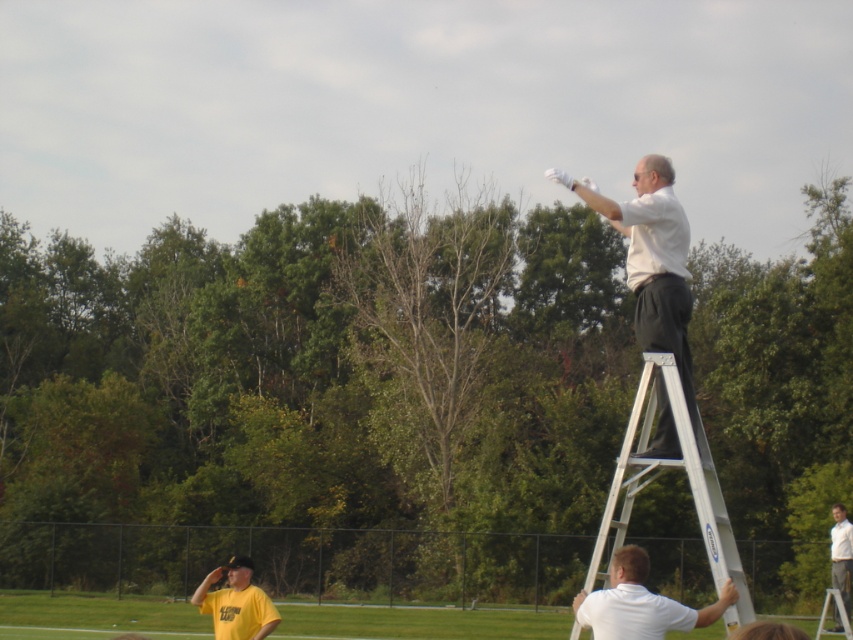
Question: Which of the following is the closest to the observer?

Choices:
 (A) white shirt at upper center
 (B) white matte shirt at lower right
 (C) yellow matte shirt at lower left
 (D) green grass football field at lower center

Answer: (B)

Question: Can you confirm if green grass football field at lower center is thinner than silver metallic ladder at upper right?

Choices:
 (A) no
 (B) yes

Answer: (A)

Question: Based on their relative distances, which object is nearer to the silver metallic ladder at upper right?

Choices:
 (A) yellow matte shirt at lower left
 (B) white matte shirt at lower right
 (C) white matte shirt at upper right

Answer: (B)

Question: Based on their relative distances, which object is farther from the green grass football field at lower center?

Choices:
 (A) yellow matte shirt at lower left
 (B) white shirt at upper center
 (C) white matte shirt at upper right

Answer: (C)

Question: Does yellow matte shirt at lower left have a lesser width compared to white shirt at upper center?

Choices:
 (A) no
 (B) yes

Answer: (A)

Question: Is silver metallic ladder at upper right further to the viewer compared to white matte shirt at lower right?

Choices:
 (A) no
 (B) yes

Answer: (A)